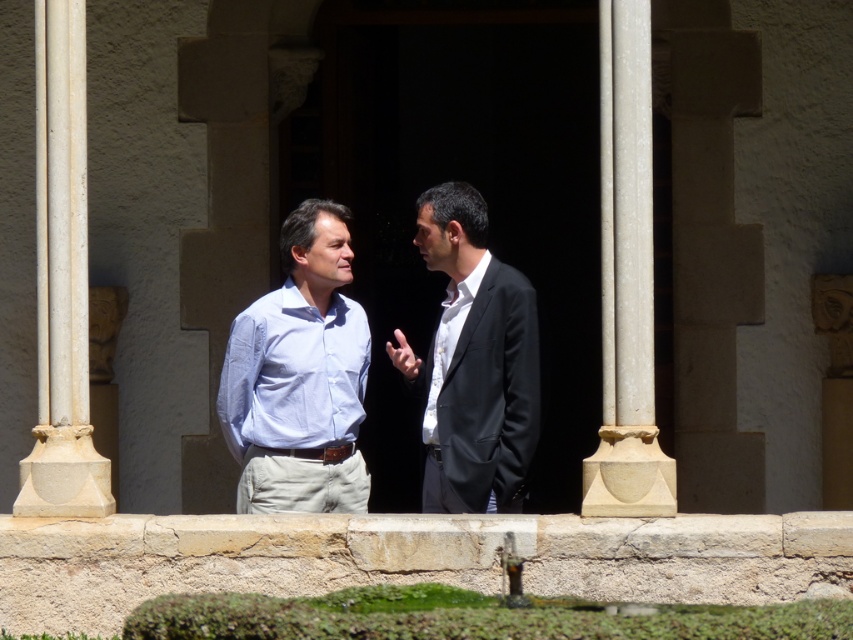
Question: Which point is farther to the camera?

Choices:
 (A) (612, 230)
 (B) (489, 300)
 (C) (39, 208)

Answer: (B)

Question: Which object appears closest to the camera in this image?

Choices:
 (A) matte black suit at center
 (B) light blue cotton shirt at center
 (C) white cotton shirt at center
 (D) white stone column at right

Answer: (D)

Question: Is white stone column at right smaller than white stone pillar at left?

Choices:
 (A) yes
 (B) no

Answer: (B)

Question: Is light blue cotton shirt at center positioned behind white stone pillar at left?

Choices:
 (A) no
 (B) yes

Answer: (B)

Question: Does white stone column at right have a lesser width compared to white cotton shirt at center?

Choices:
 (A) no
 (B) yes

Answer: (A)

Question: Considering the real-world distances, which object is farthest from the white stone column at right?

Choices:
 (A) white stone pillar at left
 (B) light blue cotton shirt at center

Answer: (A)